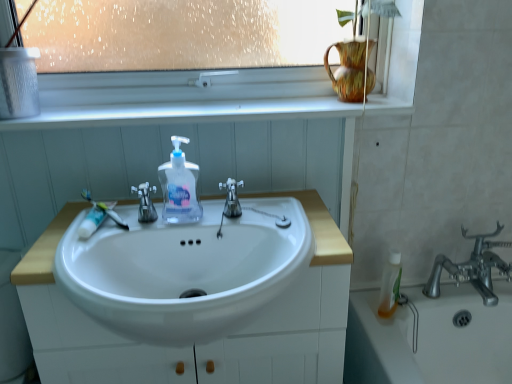
Find the location of a particular element. The image size is (512, 384). free space to the left of transparent plastic soap dispenser at center is located at coordinates (103, 232).